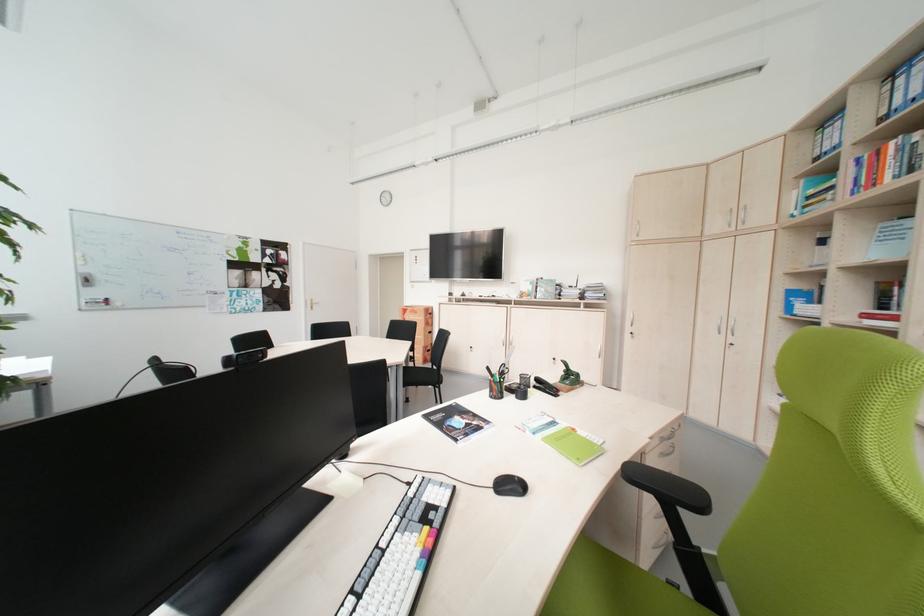
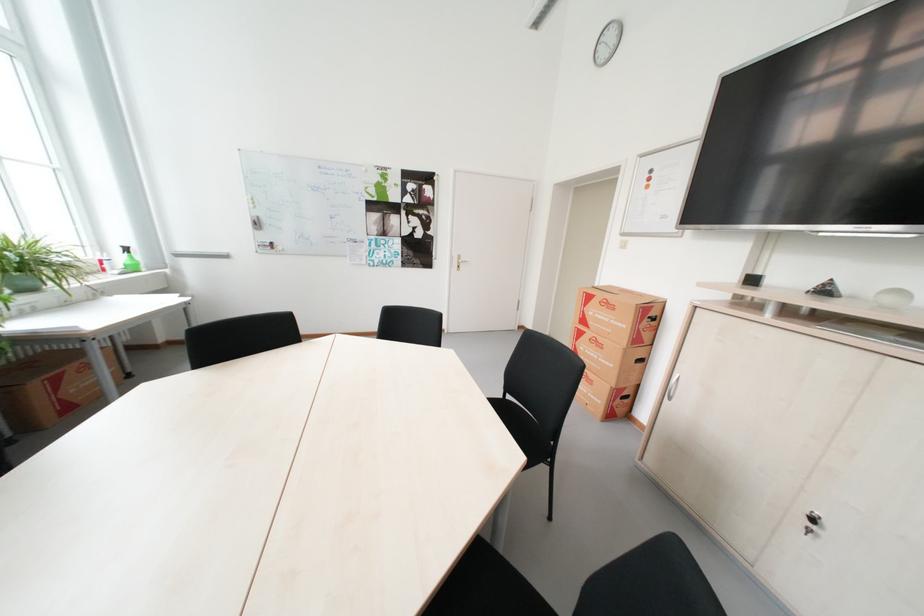
Where in the second image is the point corresponding to [418,313] from the first image?

(604, 302)